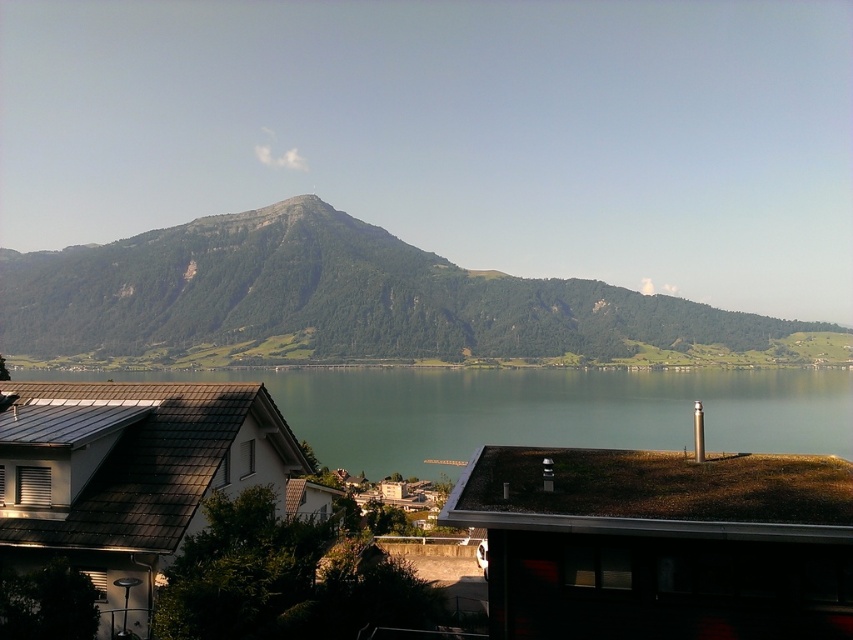
Can you confirm if green textured mountain at center is positioned below green water at center?

No.

What do you see at coordinates (334, 296) in the screenshot?
I see `green textured mountain at center` at bounding box center [334, 296].

Does point (585, 337) come farther from viewer compared to point (465, 445)?

Yes.

You are a GUI agent. You are given a task and a screenshot of the screen. Output one action in this format:
    pyautogui.click(x=<x>, y=<y>)
    Task: Click on the green textured mountain at center
    The image size is (853, 640).
    Given the screenshot: What is the action you would take?
    pyautogui.click(x=334, y=296)